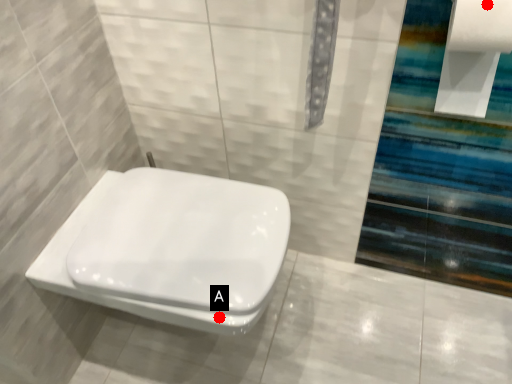
Question: Two points are circled on the image, labeled by A and B beside each circle. Which point is closer to the camera?

Choices:
 (A) A is closer
 (B) B is closer

Answer: (B)